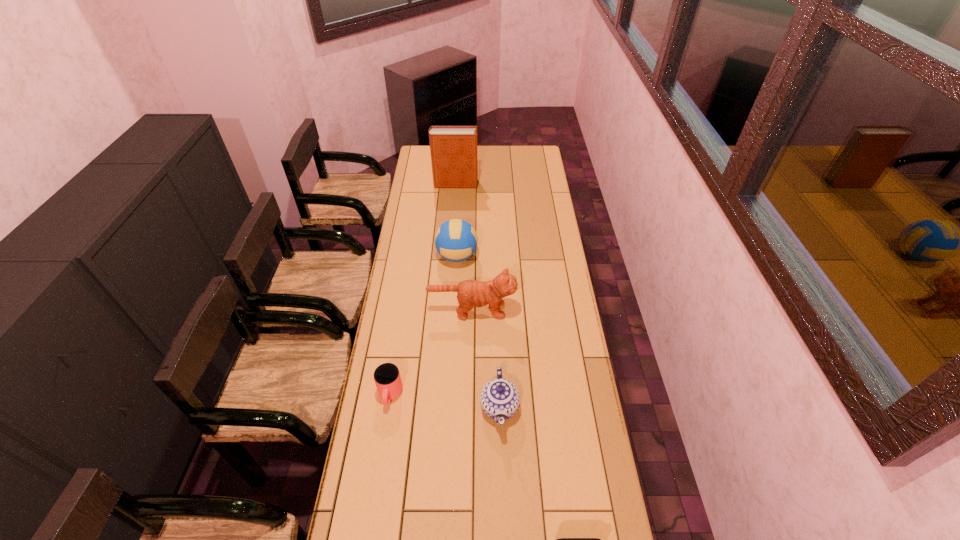
Identify the location of vacant area that satisfies the following two spatial constraints: 1. on the open cover of the farthest object; 2. on the handle side of the leftmost object. The image size is (960, 540). (442, 395).

Where is `vacant region that satisfies the following two spatial constraints: 1. on the open cover of the farthest object; 2. on the handle side of the cup`? vacant region that satisfies the following two spatial constraints: 1. on the open cover of the farthest object; 2. on the handle side of the cup is located at coordinates (442, 395).